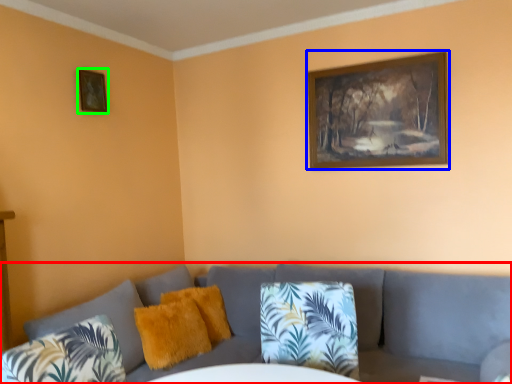
Question: Which object is the farthest from studio couch (highlighted by a red box)? Choose among these: picture frame (highlighted by a blue box) or picture frame (highlighted by a green box).

Choices:
 (A) picture frame
 (B) picture frame

Answer: (B)